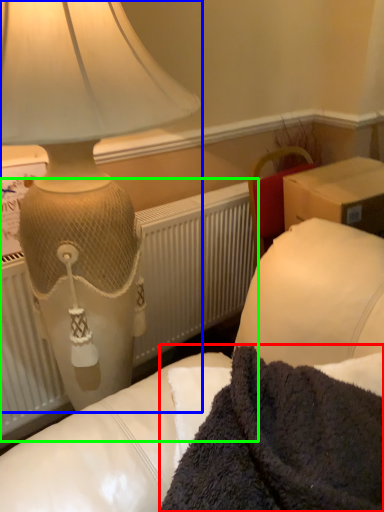
Question: Which is nearer to the blanket (highlighted by a red box)? lamp (highlighted by a blue box) or radiator (highlighted by a green box).

Choices:
 (A) lamp
 (B) radiator

Answer: (A)